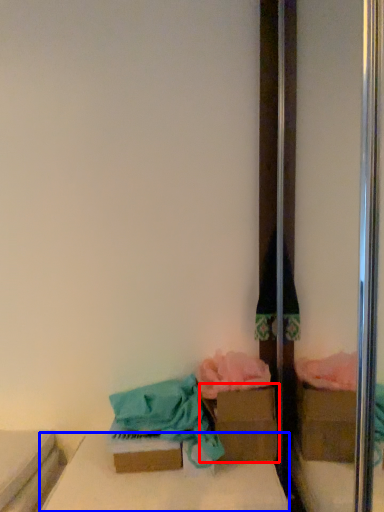
Question: Which object appears farthest to the camera in this image, cardboard box (highlighted by a red box) or furniture (highlighted by a blue box)?

Choices:
 (A) cardboard box
 (B) furniture

Answer: (A)